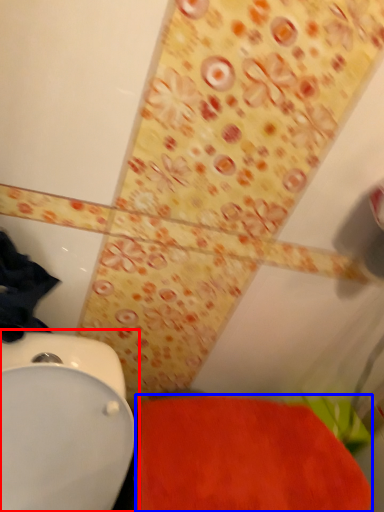
Question: Which object is closer to the camera taking this photo, toilet (highlighted by a red box) or bath mat (highlighted by a blue box)?

Choices:
 (A) toilet
 (B) bath mat

Answer: (A)